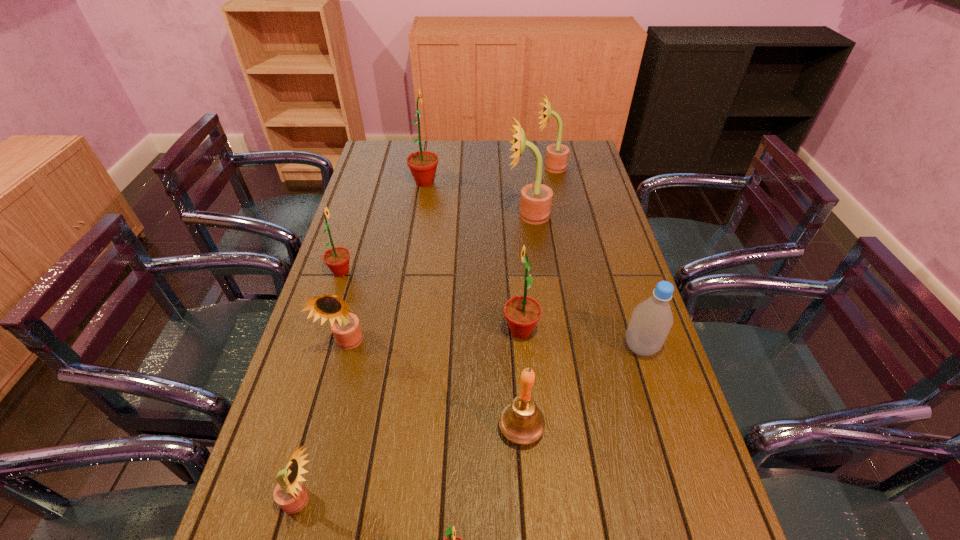
Find the location of a particular element. free space between the smallest yellow sunflower and the bell is located at coordinates (411, 464).

The width and height of the screenshot is (960, 540). I want to click on empty space between the second nearest object and the rightmost object, so click(x=470, y=423).

Where is `vacant area that lies between the fourth sunflower from left to right and the bell`? This screenshot has width=960, height=540. vacant area that lies between the fourth sunflower from left to right and the bell is located at coordinates (473, 305).

At what (x,y) coordinates should I click in order to perform the action: click on unoccupied area between the smallest yellow sunflower and the biggest yellow sunflower. Please return your answer as a coordinate pair (x, y). Looking at the image, I should click on (415, 357).

Identify the location of free spot between the third smallest yellow sunflower and the eighth farthest object. (536, 298).

Find the location of a particular element. vacant space that's between the second nearest object and the rightmost green sunflower is located at coordinates coord(411,415).

I want to click on the closest object to the gray bottle, so click(522, 313).

This screenshot has height=540, width=960. What are the coordinates of `object identified as the third closest to the seventh nearest object` in the screenshot? It's located at coord(522,313).

Choose which sunflower is the sixth nearest neighbor to the ninth farthest object. Please provide its 2D coordinates. Your answer should be formatted as a tuple, i.e. [(x, y)], where the tuple contains the x and y coordinates of a point satisfying the conditions above.

[(423, 164)]

At what (x,y) coordinates should I click in order to perform the action: click on sunflower that is the closest to the gray bottle. Please return your answer as a coordinate pair (x, y). The width and height of the screenshot is (960, 540). Looking at the image, I should click on (522, 313).